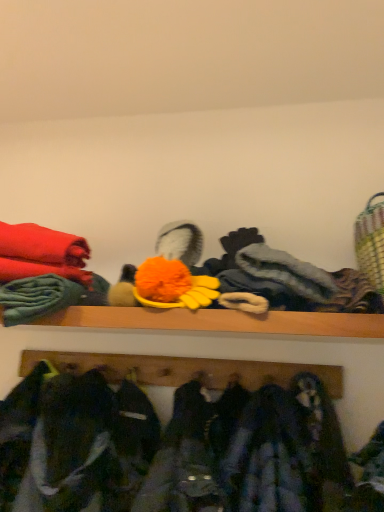
What do you see at coordinates (168, 448) in the screenshot?
I see `dark blue fabric at lower center` at bounding box center [168, 448].

Measure the distance between point (134, 415) and camera.

Point (134, 415) and camera are 1.24 meters apart from each other.

You are a GUI agent. You are given a task and a screenshot of the screen. Output one action in this format:
    pyautogui.click(x=<x>, y=<y>)
    Task: Click on the dark blue fabric at lower center
    
    Given the screenshot: What is the action you would take?
    pyautogui.click(x=168, y=448)

Locate an element on the screen. The image size is (384, 512). wooden coat rack at lower center is located at coordinates click(184, 370).

Measure the distance between wooden coat rack at lower center and camera.

wooden coat rack at lower center and camera are 3.90 feet apart from each other.

This screenshot has height=512, width=384. What do you see at coordinates (184, 370) in the screenshot? I see `wooden coat rack at lower center` at bounding box center [184, 370].

The image size is (384, 512). In order to click on dark blue fabric at lower center in this screenshot , I will do `click(168, 448)`.

Considering the positions of objects dark blue fabric at lower center and wooden coat rack at lower center in the image provided, who is more to the left, dark blue fabric at lower center or wooden coat rack at lower center?

wooden coat rack at lower center is more to the left.

From the picture: Which object is closer to the camera, dark blue fabric at lower center or wooden coat rack at lower center?

dark blue fabric at lower center is in front.

Between point (38, 431) and point (151, 373), which one is positioned behind?

The point (151, 373) is farther from the camera.

In the scene shown: From the image's perspective, is dark blue fabric at lower center below wooden coat rack at lower center?

Correct, dark blue fabric at lower center appears lower than wooden coat rack at lower center in the image.

From a real-world perspective, which is physically below, dark blue fabric at lower center or wooden coat rack at lower center?

From a 3D spatial view, dark blue fabric at lower center is below.

Considering the sizes of objects dark blue fabric at lower center and wooden coat rack at lower center in the image provided, who is wider, dark blue fabric at lower center or wooden coat rack at lower center?

With larger width is dark blue fabric at lower center.

Considering the relative sizes of dark blue fabric at lower center and wooden coat rack at lower center in the image provided, is dark blue fabric at lower center taller than wooden coat rack at lower center?

Indeed, dark blue fabric at lower center has a greater height compared to wooden coat rack at lower center.

Considering the relative sizes of dark blue fabric at lower center and wooden coat rack at lower center in the image provided, is dark blue fabric at lower center bigger than wooden coat rack at lower center?

Indeed, dark blue fabric at lower center has a larger size compared to wooden coat rack at lower center.

Is wooden coat rack at lower center located within dark blue fabric at lower center?

No, wooden coat rack at lower center is not a part of dark blue fabric at lower center.

Is the surface of dark blue fabric at lower center in direct contact with wooden coat rack at lower center?

No.

Is dark blue fabric at lower center facing towards wooden coat rack at lower center?

No.

Image resolution: width=384 pixels, height=512 pixels. Find the location of `shelf above the dark blue fabric at lower center (from the image's perspective)`. shelf above the dark blue fabric at lower center (from the image's perspective) is located at coordinates (184, 370).

Between wooden coat rack at lower center and dark blue fabric at lower center, which one appears on the right side from the viewer's perspective?

From the viewer's perspective, dark blue fabric at lower center appears more on the right side.

Relative to dark blue fabric at lower center, is wooden coat rack at lower center in front or behind?

wooden coat rack at lower center is behind dark blue fabric at lower center.

Which is in front, point (247, 377) or point (169, 466)?

The point (169, 466) is closer to the camera.

From the image's perspective, is wooden coat rack at lower center located above or below dark blue fabric at lower center?

wooden coat rack at lower center is above dark blue fabric at lower center.

From a real-world perspective, is wooden coat rack at lower center located higher than dark blue fabric at lower center?

Correct, in the physical world, wooden coat rack at lower center is higher than dark blue fabric at lower center.

Between wooden coat rack at lower center and dark blue fabric at lower center, which one has larger width?

dark blue fabric at lower center.

Considering the sizes of objects wooden coat rack at lower center and dark blue fabric at lower center in the image provided, who is taller, wooden coat rack at lower center or dark blue fabric at lower center?

Answer: dark blue fabric at lower center is taller.

Considering the sizes of objects wooden coat rack at lower center and dark blue fabric at lower center in the image provided, who is bigger, wooden coat rack at lower center or dark blue fabric at lower center?

With larger size is dark blue fabric at lower center.

Is wooden coat rack at lower center inside or outside of dark blue fabric at lower center?

wooden coat rack at lower center is not inside dark blue fabric at lower center, it's outside.

Is wooden coat rack at lower center touching dark blue fabric at lower center?

They are not placed beside each other.

Could you tell me if wooden coat rack at lower center is turned towards dark blue fabric at lower center?

Yes, wooden coat rack at lower center is aimed at dark blue fabric at lower center.

How different are the orientations of wooden coat rack at lower center and dark blue fabric at lower center in degrees?

The angle between the facing direction of wooden coat rack at lower center and the facing direction of dark blue fabric at lower center is 2.45 degrees.

How much distance is there between wooden coat rack at lower center and dark blue fabric at lower center?

wooden coat rack at lower center is 17.23 centimeters from dark blue fabric at lower center.

I want to click on shelf that is above the dark blue fabric at lower center (from a real-world perspective), so click(184, 370).

Where is `shelf that appears on the left of dark blue fabric at lower center`? shelf that appears on the left of dark blue fabric at lower center is located at coordinates (184, 370).

Find the location of a particular element. This screenshot has height=512, width=384. shelf that appears above the dark blue fabric at lower center (from the image's perspective) is located at coordinates (184, 370).